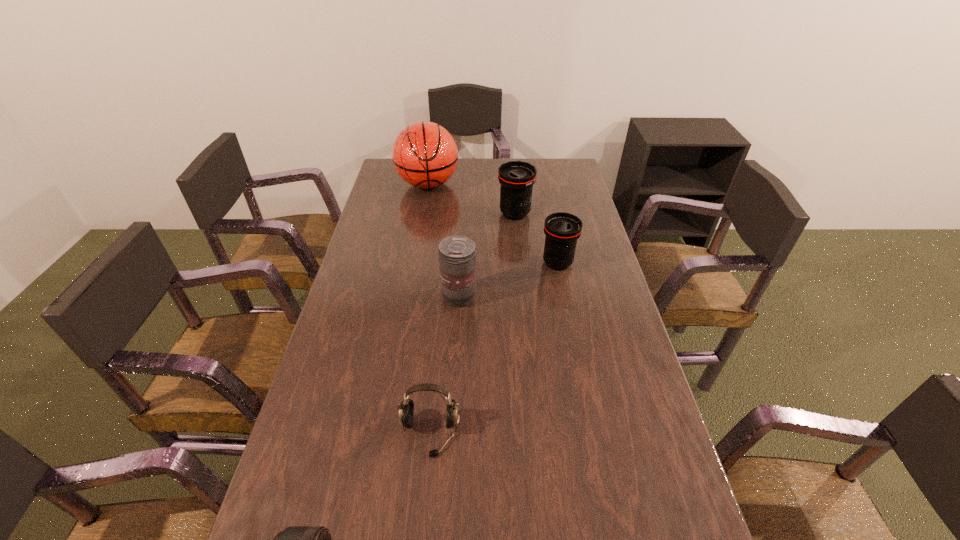
Locate an element on the screen. free space between the farthest object and the second nearest object is located at coordinates (429, 309).

What are the coordinates of `free space that is in between the farthest telephoto lens and the farthest object` in the screenshot? It's located at (471, 199).

Find the location of a particular element. The width and height of the screenshot is (960, 540). free area in between the farthest telephoto lens and the farthest object is located at coordinates (471, 199).

In order to click on free space that is in between the fourth nearest object and the third telephoto lens from right to left in this screenshot , I will do `click(509, 280)`.

What are the coordinates of `free spot between the fifth nearest object and the farthest object` in the screenshot? It's located at (471, 199).

Identify the location of free space between the tallest object and the farthest telephoto lens. The image size is (960, 540). (x=471, y=199).

The width and height of the screenshot is (960, 540). I want to click on blank region between the farthest object and the fourth nearest object, so click(x=492, y=224).

Locate which object is the second closest to the third farthest telephoto lens. Please provide its 2D coordinates. Your answer should be formatted as a tuple, i.e. [(x, y)], where the tuple contains the x and y coordinates of a point satisfying the conditions above.

[(406, 408)]

The width and height of the screenshot is (960, 540). Find the location of `the fourth closest object to the third nearest telephoto lens`. the fourth closest object to the third nearest telephoto lens is located at coordinates (406, 408).

Find the location of a particular element. Image resolution: width=960 pixels, height=540 pixels. telephoto lens that is the second closest to the fourth farthest object is located at coordinates (516, 178).